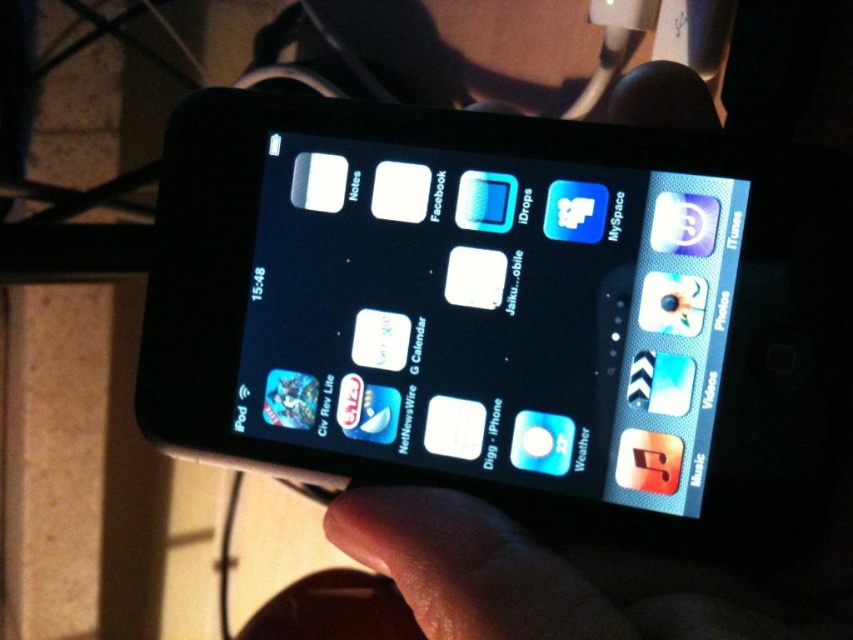
You are holding a black matte hand at center. Can you determine if the black plastic smartphone at center will fit entirely within your hand?

The black plastic smartphone at center might be wider than black matte hand at center, so it may not fit entirely within your hand.